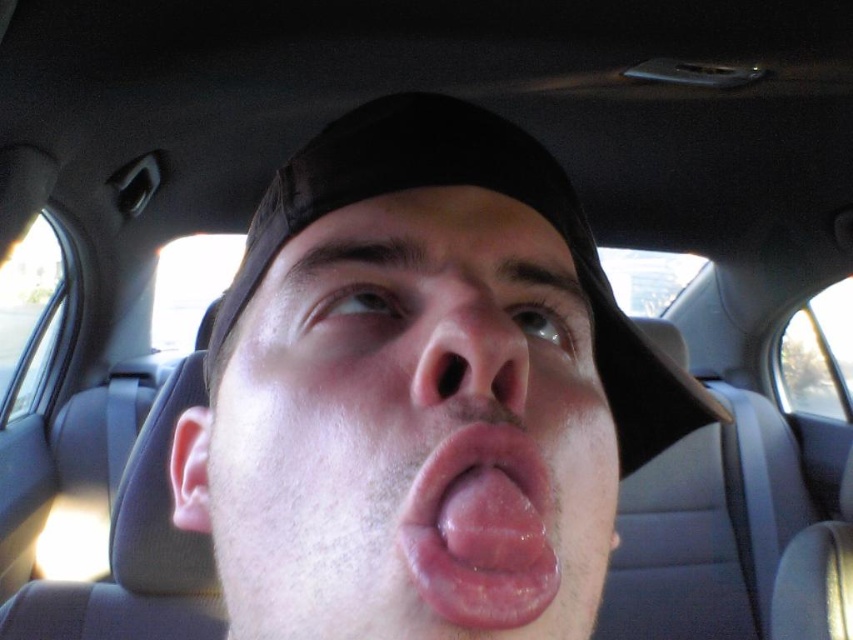
You are a photographer trying to capture a candid shot of the smooth skin face at center. The camera you are using has a focus point at coordinate 0.677, 0.479. Will the focus point align with the subject?

Yes, the smooth skin face at center is located exactly at point [408,433], so the focus point will align with the subject.